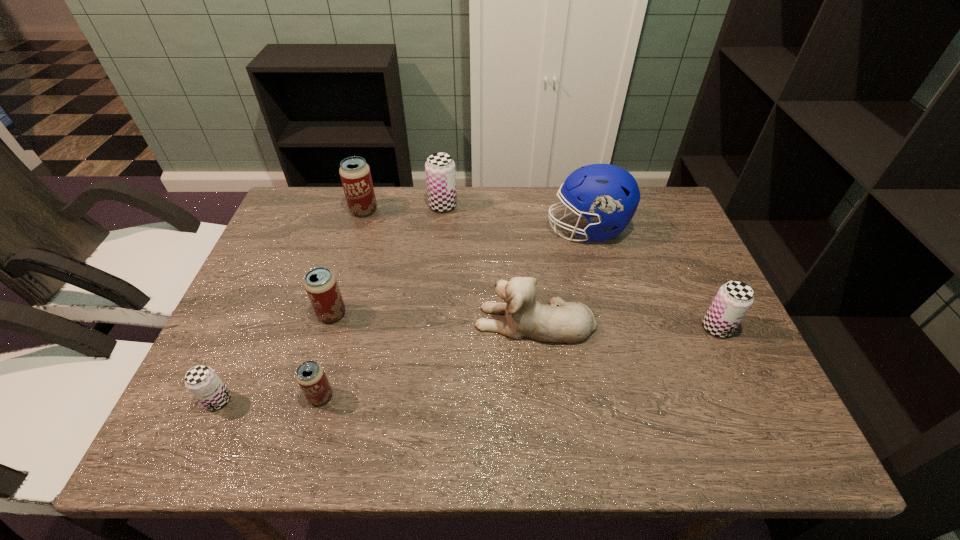
You are a GUI agent. You are given a task and a screenshot of the screen. Output one action in this format:
    pyautogui.click(x=<x>, y=<y>)
    Task: Click on the object that is at the far right corner
    This screenshot has width=960, height=540.
    Given the screenshot: What is the action you would take?
    pyautogui.click(x=606, y=195)

Find the location of a particular element. The width and height of the screenshot is (960, 540). vacant space at the far edge is located at coordinates (387, 198).

Image resolution: width=960 pixels, height=540 pixels. Identify the location of blank space at the near edge of the desktop. (x=466, y=454).

At what (x,y) coordinates should I click in order to perform the action: click on vacant space at the left edge. Please return your answer as a coordinate pair (x, y). The height and width of the screenshot is (540, 960). Looking at the image, I should click on (243, 334).

You are a GUI agent. You are given a task and a screenshot of the screen. Output one action in this format:
    pyautogui.click(x=<x>, y=<y>)
    Task: Click on the vacant space at the right edge of the desktop
    The image size is (960, 540).
    Given the screenshot: What is the action you would take?
    pyautogui.click(x=759, y=403)

You are a GUI agent. You are given a task and a screenshot of the screen. Output one action in this format:
    pyautogui.click(x=<x>, y=<y>)
    Task: Click on the blank area at the far left corner
    The height and width of the screenshot is (540, 960).
    Given the screenshot: What is the action you would take?
    pyautogui.click(x=329, y=204)

At what (x,y) coordinates should I click in order to perform the action: click on free space between the second biggest purple beer can and the tallest object. Please return your answer as a coordinate pair (x, y). This screenshot has width=960, height=540. Looking at the image, I should click on (652, 279).

This screenshot has height=540, width=960. I want to click on vacant region between the farthest red beer can and the second farthest red beer can, so [x=348, y=262].

Identify the location of free space between the blue football helmet and the second nearest red beer can. This screenshot has height=540, width=960. (460, 272).

Find the location of a particular element. The width and height of the screenshot is (960, 540). free space that is in between the second farthest red beer can and the second purple beer can from left to right is located at coordinates (388, 260).